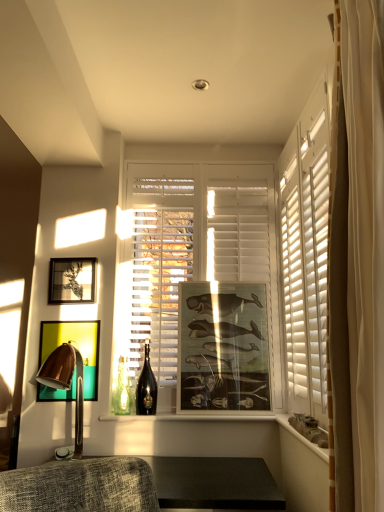
Question: From a real-world perspective, is white matte window at center physically below matte black picture frame at upper left, the 3th picture frame in the right-to-left sequence?

Choices:
 (A) yes
 (B) no

Answer: (B)

Question: Is white matte window at center aimed at matte black picture frame at upper left, the 3th picture frame in the right-to-left sequence?

Choices:
 (A) no
 (B) yes

Answer: (A)

Question: Is white matte window at center behind matte black picture frame at upper left, the 3th picture frame in the right-to-left sequence?

Choices:
 (A) no
 (B) yes

Answer: (B)

Question: Would you say white matte window at center is a long distance from matte black picture frame at upper left, the 3th picture frame in the right-to-left sequence?

Choices:
 (A) no
 (B) yes

Answer: (A)

Question: From the image's perspective, is white matte window at center located above matte black picture frame at upper left, arranged as the 1th picture frame when viewed from the left?

Choices:
 (A) yes
 (B) no

Answer: (A)

Question: Can we say white matte window at center lies outside matte black picture frame at upper left, arranged as the 1th picture frame when viewed from the left?

Choices:
 (A) no
 (B) yes

Answer: (B)

Question: Considering the relative positions of metallic gold picture frame at left, which ranks as the 2th picture frame in right-to-left order, and shiny dark glass bottle at center in the image provided, is metallic gold picture frame at left, which ranks as the 2th picture frame in right-to-left order, to the left of shiny dark glass bottle at center from the viewer's perspective?

Choices:
 (A) no
 (B) yes

Answer: (B)

Question: Can you confirm if metallic gold picture frame at left, which ranks as the 2th picture frame in right-to-left order, is wider than shiny dark glass bottle at center?

Choices:
 (A) yes
 (B) no

Answer: (B)

Question: Is metallic gold picture frame at left, which is counted as the second picture frame, starting from the left, looking in the opposite direction of shiny dark glass bottle at center?

Choices:
 (A) no
 (B) yes

Answer: (A)

Question: Could you tell me if metallic gold picture frame at left, which ranks as the 2th picture frame in right-to-left order, is facing shiny dark glass bottle at center?

Choices:
 (A) yes
 (B) no

Answer: (B)

Question: Considering the relative sizes of metallic gold picture frame at left, which is counted as the second picture frame, starting from the left, and shiny dark glass bottle at center in the image provided, is metallic gold picture frame at left, which is counted as the second picture frame, starting from the left, taller than shiny dark glass bottle at center?

Choices:
 (A) yes
 (B) no

Answer: (A)

Question: From the image's perspective, does metallic gold picture frame at left, which ranks as the 2th picture frame in right-to-left order, appear higher than shiny dark glass bottle at center?

Choices:
 (A) yes
 (B) no

Answer: (A)

Question: Can you confirm if copper metallic table lamp at left is positioned to the left of matte wooden picture frame at center, positioned as the 3th picture frame in left-to-right order?

Choices:
 (A) yes
 (B) no

Answer: (A)